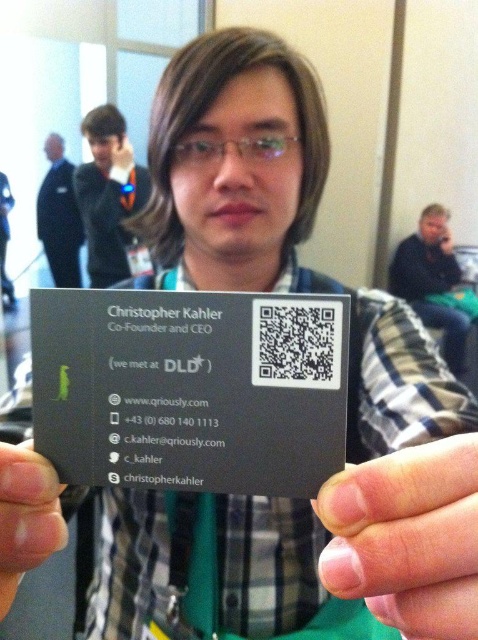
You are a graphic designer reviewing Christopher Kahler business card. You need to ensure that the black matte qr code at center and the nail at center are proportionate to each other. According to the design specifications, which object should be adjusted to maintain proper proportions?

The nail at center should be adjusted because the black matte qr code at center is larger in width than the nail at center, so the nail needs to be made larger to match the qr code or the qr code should be reduced in size to align with the nail.

You are standing 10 inches away from the business card held by the person. Can you reach the point at coordinates point (x=9, y=445) on the card?

The distance of point (x=9, y=445) from viewer is 12.66 inches, so you are 2.66 inches too far to reach it.